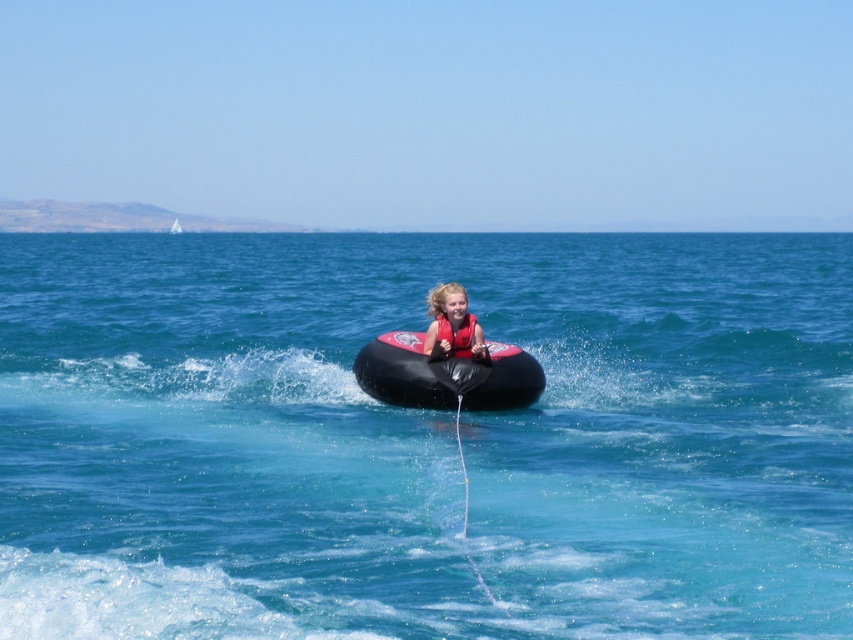
Question: Which object is closer to the camera taking this photo?

Choices:
 (A) matte red life vest at center
 (B) black rubber tube at center
 (C) red matte life jacket at center

Answer: (B)

Question: In this image, where is translucent rubber tube at center located relative to red matte life jacket at center?

Choices:
 (A) above
 (B) below

Answer: (A)

Question: Which point is farther to the camera?

Choices:
 (A) (788, 616)
 (B) (448, 355)

Answer: (B)

Question: Is black rubber tube at center below matte red life vest at center?

Choices:
 (A) yes
 (B) no

Answer: (A)

Question: Is translucent rubber tube at center bigger than matte red life vest at center?

Choices:
 (A) yes
 (B) no

Answer: (A)

Question: Which point is closer to the camera taking this photo?

Choices:
 (A) (438, 316)
 (B) (463, 340)
 (C) (785, 540)

Answer: (C)